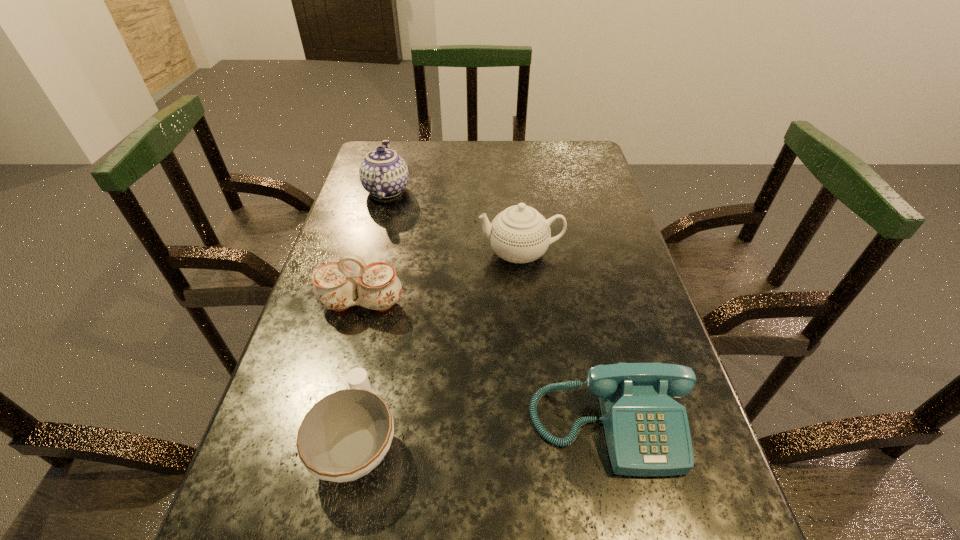
Identify the location of free spot at the left edge of the desktop. (405, 187).

The image size is (960, 540). I want to click on vacant space at the right edge of the desktop, so click(580, 226).

Find the location of a particular element. The height and width of the screenshot is (540, 960). vacant space that's between the farthest chinaware and the telephone is located at coordinates (498, 307).

Image resolution: width=960 pixels, height=540 pixels. I want to click on vacant area that lies between the nearest chinaware and the farthest object, so click(x=372, y=315).

Image resolution: width=960 pixels, height=540 pixels. Find the location of `free space between the third nearest object and the farthest object`. free space between the third nearest object and the farthest object is located at coordinates (374, 247).

Locate an element on the screen. This screenshot has height=540, width=960. vacant area between the second farthest object and the telephone is located at coordinates (564, 339).

Identify the location of free space that is in between the rightmost chinaware and the farthest object. This screenshot has height=540, width=960. (454, 222).

What are the coordinates of `free spot between the farthest object and the rightmost chinaware` in the screenshot? It's located at (454, 222).

I want to click on free space between the third nearest object and the telephone, so click(486, 364).

Find the location of a particular element. Image resolution: width=960 pixels, height=540 pixels. empty space that is in between the shortest object and the fourth tallest object is located at coordinates (483, 433).